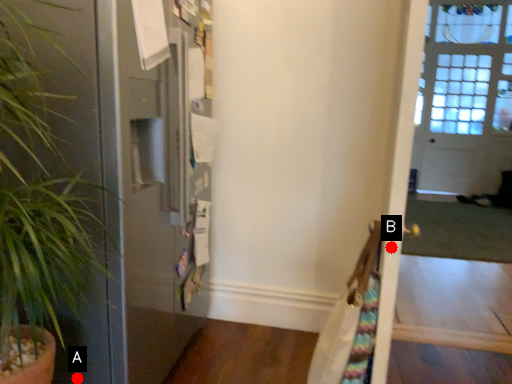
Question: Two points are circled on the image, labeled by A and B beside each circle. Which point is farther to the camera?

Choices:
 (A) A is further
 (B) B is further

Answer: (A)